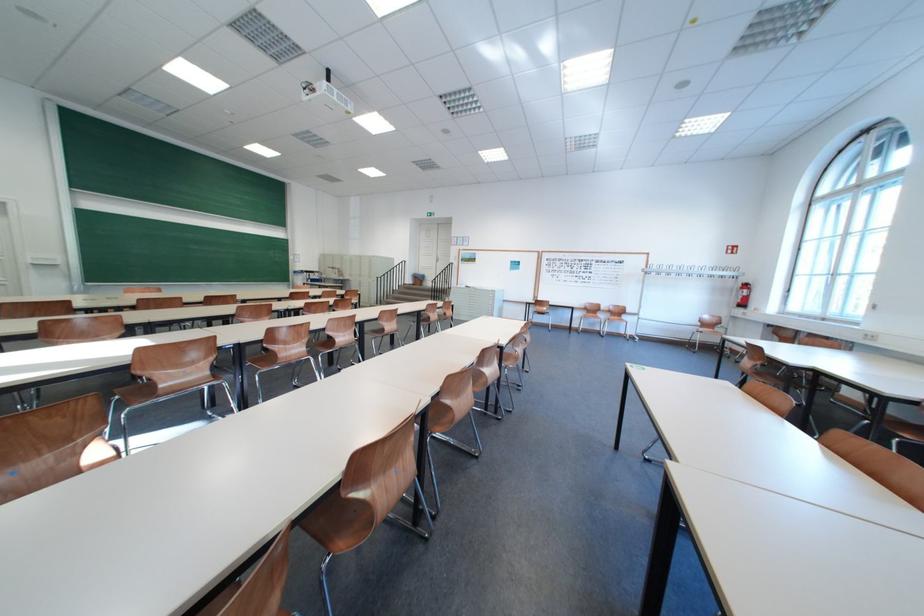
At what (x,y) coordinates should I click in order to perform the action: click on wall coat hook. Please return your answer as a coordinate pair (x, y). The image size is (924, 616). Looking at the image, I should click on point(694,270).